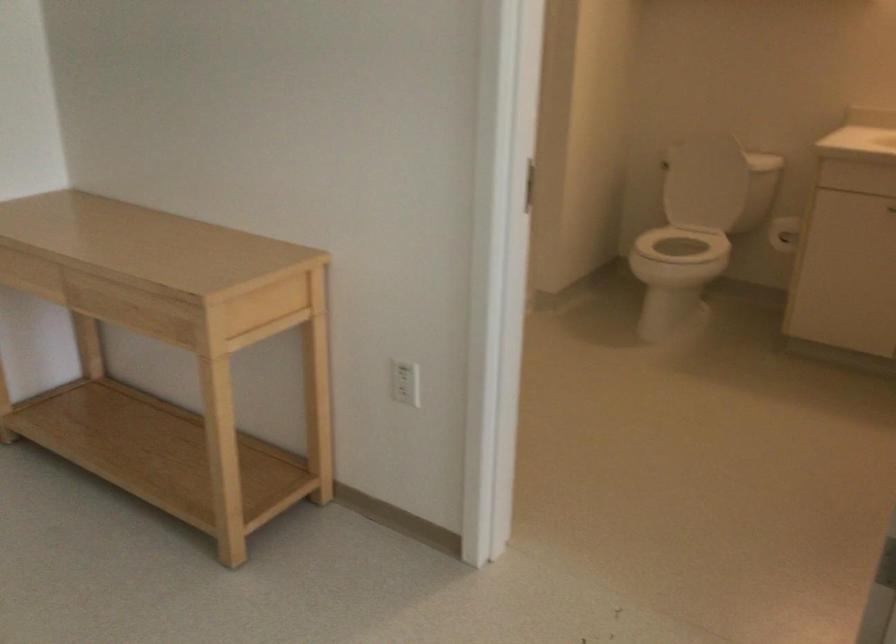
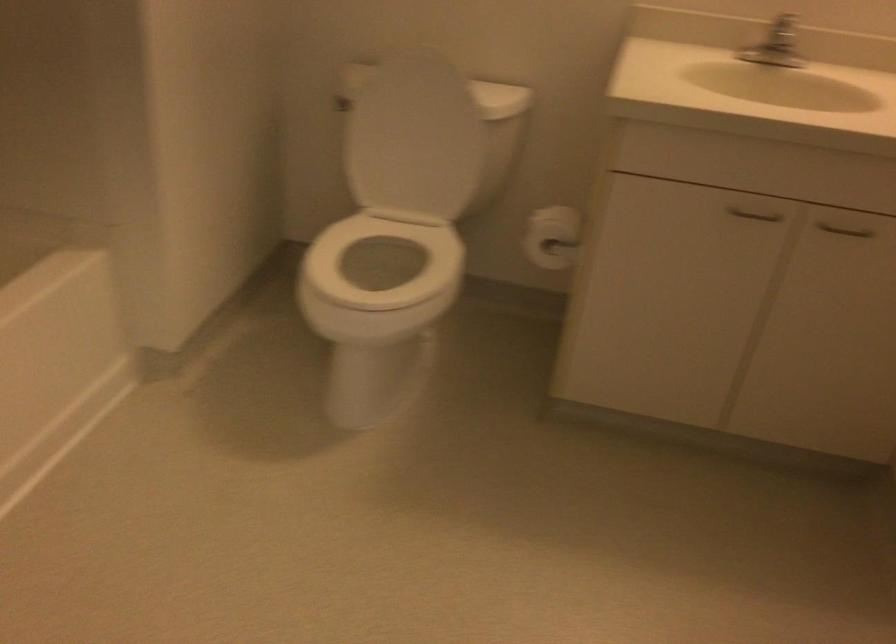
Locate, in the second image, the point that corresponds to point 789,222 in the first image.

(552, 237)